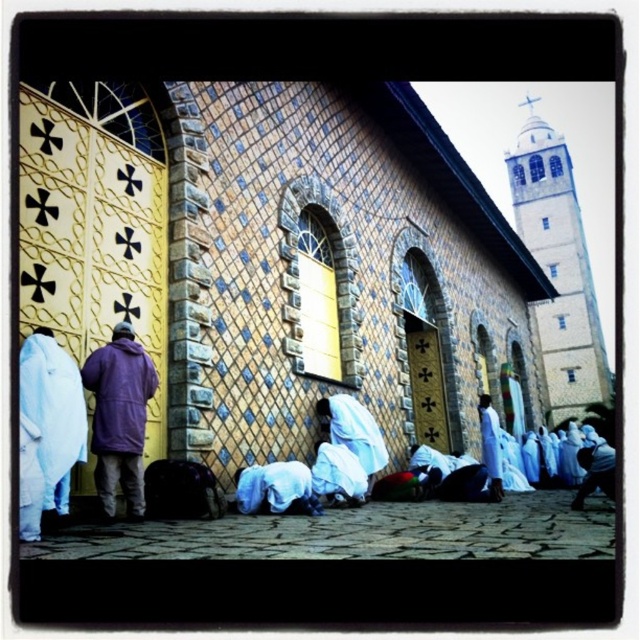
Question: Is yellow tiled church at center to the right of white matte cloth at center from the viewer's perspective?

Choices:
 (A) yes
 (B) no

Answer: (A)

Question: Which object is closer to the camera taking this photo?

Choices:
 (A) stone tower at upper right
 (B) white cotton robe at center

Answer: (B)

Question: Considering the real-world distances, which object is closest to the white cotton robe at center?

Choices:
 (A) yellow tiled church at center
 (B) purple fleece jacket at left
 (C) white matte robe at center

Answer: (B)

Question: Which of the following is the closest to the observer?

Choices:
 (A) (120, 413)
 (B) (496, 220)
 (C) (566, 280)
 (D) (333, 490)

Answer: (A)

Question: Is purple fleece jacket at left positioned behind white matte robe at lower left?

Choices:
 (A) no
 (B) yes

Answer: (B)

Question: Where is white cotton robe at center located in relation to white matte robe at center in the image?

Choices:
 (A) left
 (B) right

Answer: (A)